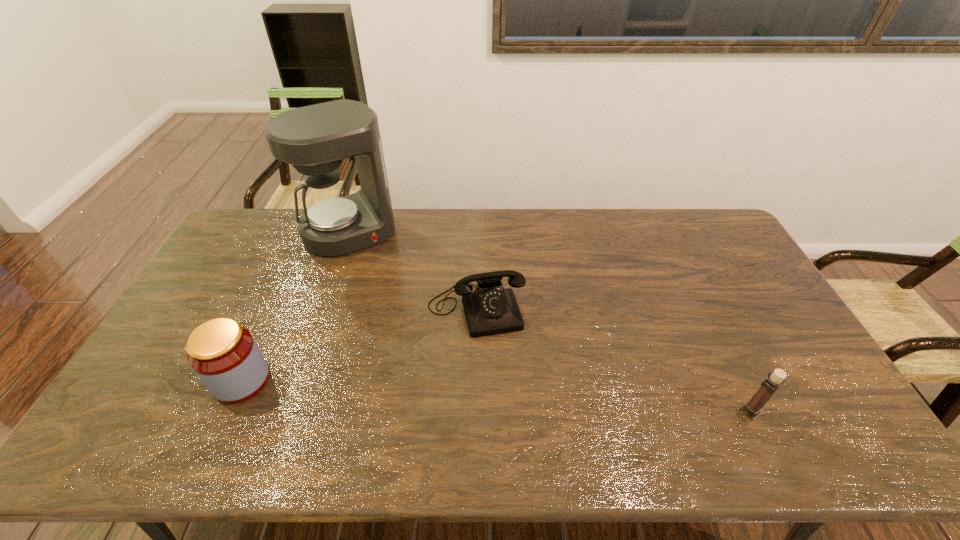
This screenshot has width=960, height=540. In order to click on jar in this screenshot , I will do `click(224, 355)`.

The height and width of the screenshot is (540, 960). I want to click on candle holder, so click(x=776, y=379).

The height and width of the screenshot is (540, 960). I want to click on the shortest object, so click(x=490, y=309).

Locate an element on the screen. the third object from left to right is located at coordinates 490,309.

Identify the location of coffee maker. (314, 139).

I want to click on the tallest object, so click(314, 139).

At what (x,y) coordinates should I click in order to perform the action: click on vacant area located on the right of the jar. Please return your answer as a coordinate pair (x, y). Looking at the image, I should click on (400, 380).

Where is `free space located 0.060m on the back of the rightmost object`? This screenshot has width=960, height=540. free space located 0.060m on the back of the rightmost object is located at coordinates (736, 382).

This screenshot has height=540, width=960. What are the coordinates of `vacant area located on the front face of the third object from left to right` in the screenshot? It's located at (503, 404).

The height and width of the screenshot is (540, 960). In order to click on vacant space located on the front face of the third object from left to right in this screenshot , I will do (x=494, y=372).